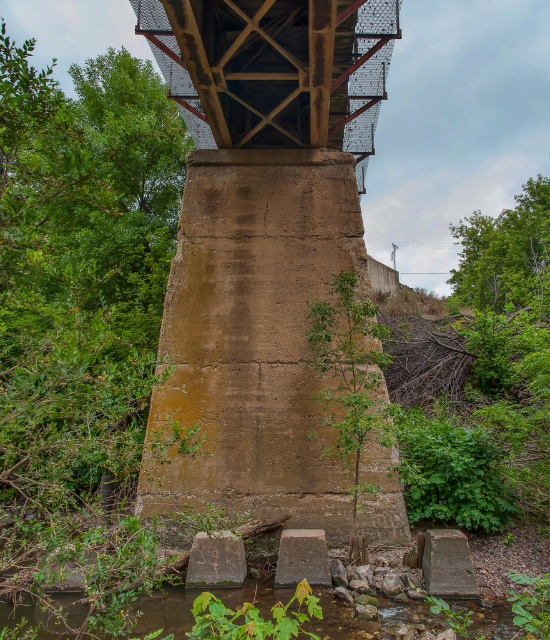
Question: Considering the relative positions of rusty metal bridge at upper center and brown rocky river at lower center in the image provided, where is rusty metal bridge at upper center located with respect to brown rocky river at lower center?

Choices:
 (A) right
 (B) left

Answer: (B)

Question: Which object appears closest to the camera in this image?

Choices:
 (A) brown rocky river at lower center
 (B) rusty metal bridge at upper center

Answer: (A)

Question: Among these objects, which one is nearest to the camera?

Choices:
 (A) brown rocky river at lower center
 (B) rusty metal bridge at upper center

Answer: (A)

Question: Does rusty metal bridge at upper center appear on the left side of brown rocky river at lower center?

Choices:
 (A) yes
 (B) no

Answer: (A)

Question: Is rusty metal bridge at upper center wider than brown rocky river at lower center?

Choices:
 (A) yes
 (B) no

Answer: (A)